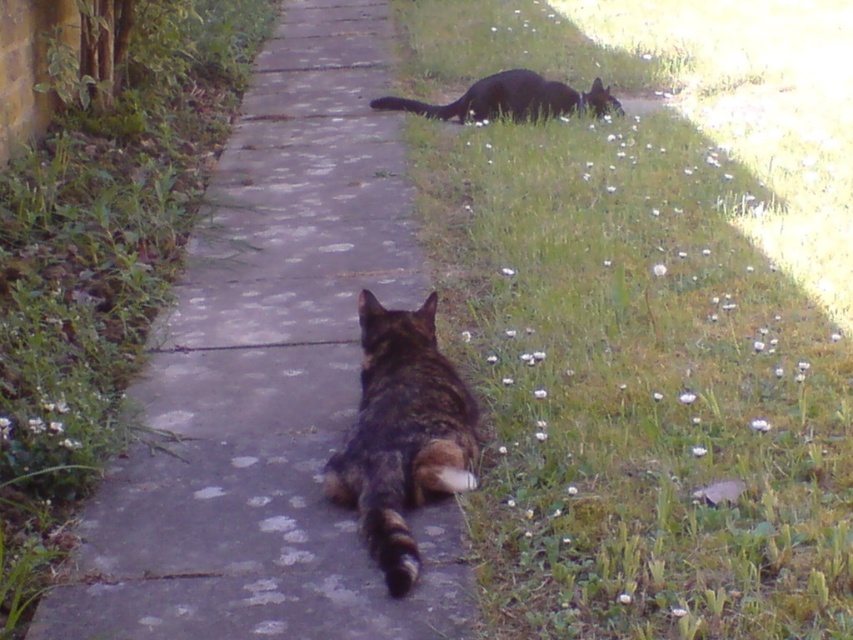
Which of these two, gray concrete pavement at center or black fur cat at upper right, stands taller?

With more height is gray concrete pavement at center.

Identify the location of gray concrete pavement at center. Image resolution: width=853 pixels, height=640 pixels. (270, 378).

Is gray concrete pavement at center further to the viewer compared to tabby fur cat at center?

That is True.

Is gray concrete pavement at center shorter than tabby fur cat at center?

Correct, gray concrete pavement at center is not as tall as tabby fur cat at center.

What are the coordinates of `gray concrete pavement at center` in the screenshot? It's located at (270, 378).

Who is higher up, green grass at upper right or tabby fur cat at center?

green grass at upper right is higher up.

Identify the location of green grass at upper right. (637, 387).

The width and height of the screenshot is (853, 640). What do you see at coordinates (637, 387) in the screenshot?
I see `green grass at upper right` at bounding box center [637, 387].

At what (x,y) coordinates should I click in order to perform the action: click on green grass at upper right. Please return your answer as a coordinate pair (x, y). This screenshot has height=640, width=853. Looking at the image, I should click on (637, 387).